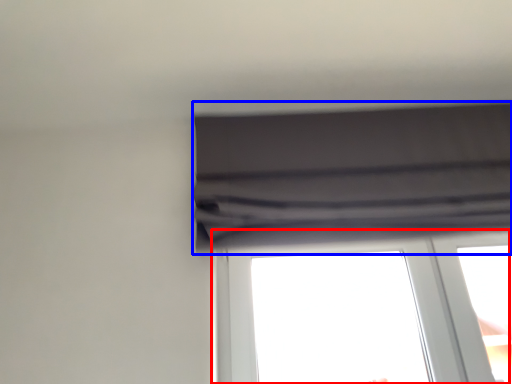
Question: Which of the following is the farthest to the observer, window (highlighted by a red box) or curtain (highlighted by a blue box)?

Choices:
 (A) window
 (B) curtain

Answer: (A)